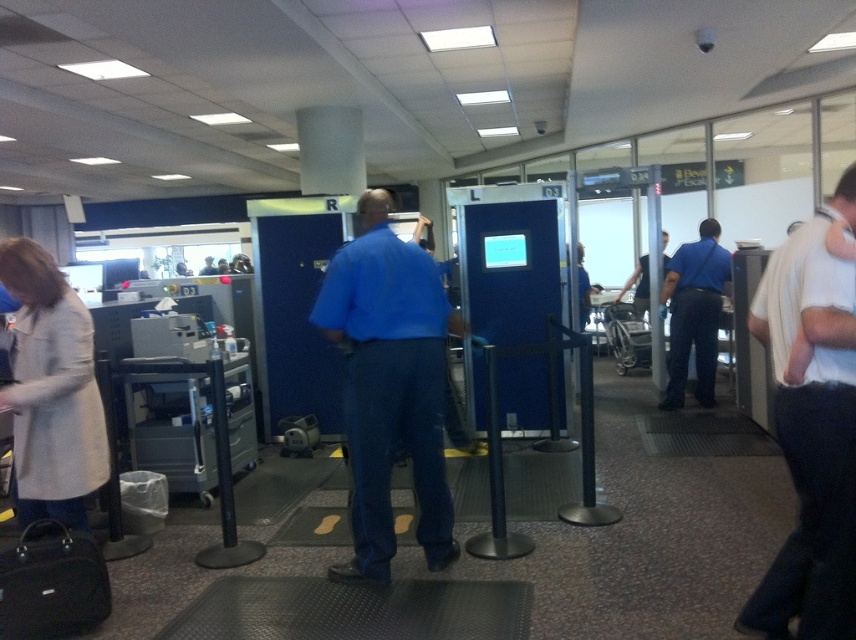
You are a traveler at the airport security checkpoint. You see the blue cotton shirt at center and the black leather suitcase at lower left. Which object is positioned more to the right side of the scene?

The blue cotton shirt at center is positioned more to the right side of the scene compared to the black leather suitcase at lower left.

You are a traveler at the airport security checkpoint. You see a white cotton shirt at right and a light beige coat at left. Which item is nearer to you?

The white cotton shirt at right is closer to the viewer than the light beige coat at left.

You are a traveler at the airport security checkpoint. You notice two items in the image, the white cotton shirt at right and the light beige coat at left. Which item is positioned lower in the frame?

The white cotton shirt at right is located below the light beige coat at left, so it is positioned lower in the frame.